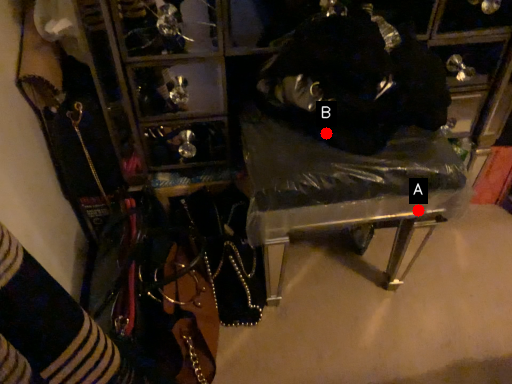
Question: Two points are circled on the image, labeled by A and B beside each circle. Which point is farther to the camera?

Choices:
 (A) A is further
 (B) B is further

Answer: (A)